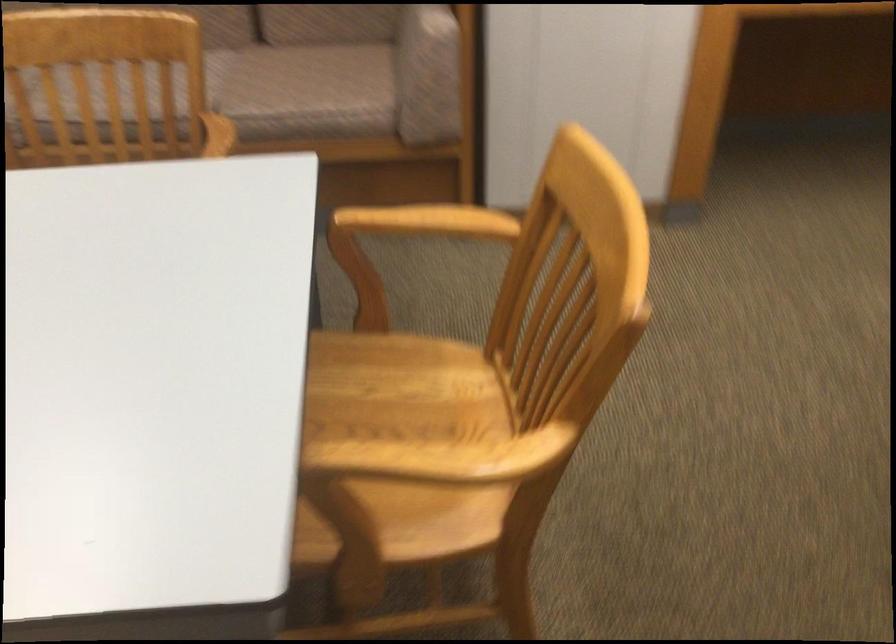
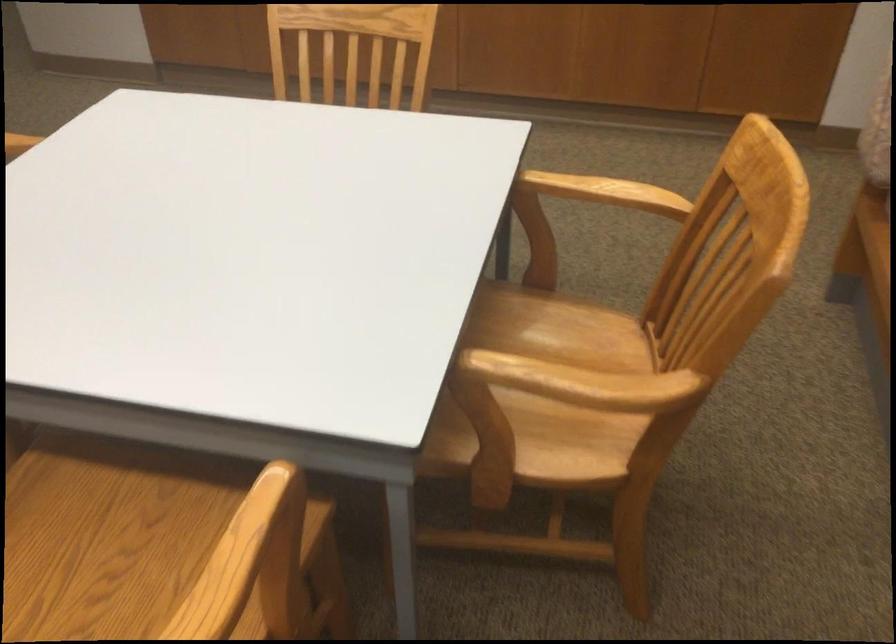
Locate, in the second image, the point that corresponds to pixel 214 142 in the first image.

(583, 383)